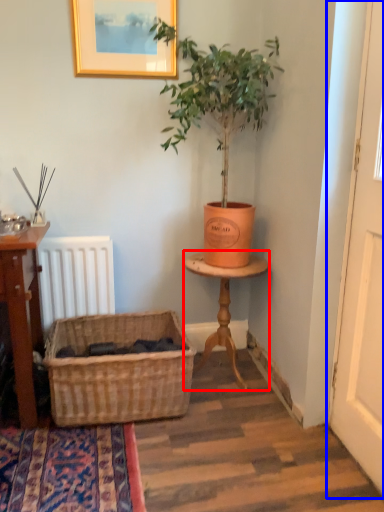
Question: Which of the following is the closest to the observer, table (highlighted by a red box) or screen door (highlighted by a blue box)?

Choices:
 (A) table
 (B) screen door

Answer: (B)